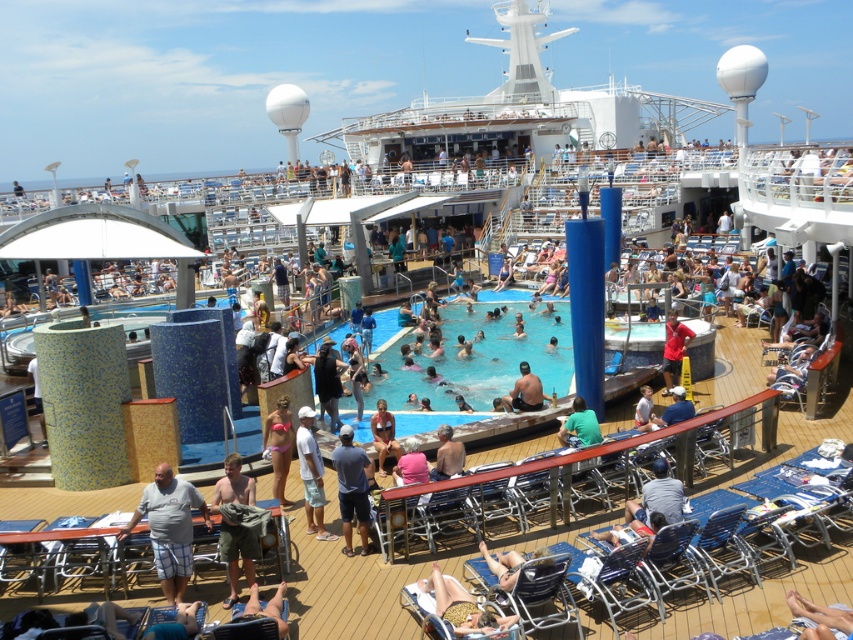
Question: Which point is closer to the camera?

Choices:
 (A) (538, 561)
 (B) (675, 422)

Answer: (A)

Question: Is gray plaid shorts at lower left wider than skinny man at center?

Choices:
 (A) no
 (B) yes

Answer: (B)

Question: Which point is closer to the camera taking this photo?

Choices:
 (A) (300, 461)
 (B) (577, 429)
 (C) (508, 394)
 (D) (238, 472)

Answer: (D)

Question: Is dark blue t-shirt at center to the left of red fabric shirt at center from the viewer's perspective?

Choices:
 (A) yes
 (B) no

Answer: (A)

Question: Is pink bikini at center bigger than blue fabric chair at lower right?

Choices:
 (A) yes
 (B) no

Answer: (B)

Question: Among these points, which one is nearest to the camera?

Choices:
 (A) [x=659, y=419]
 (B) [x=498, y=582]
 (C) [x=664, y=353]
 (D) [x=218, y=509]

Answer: (B)